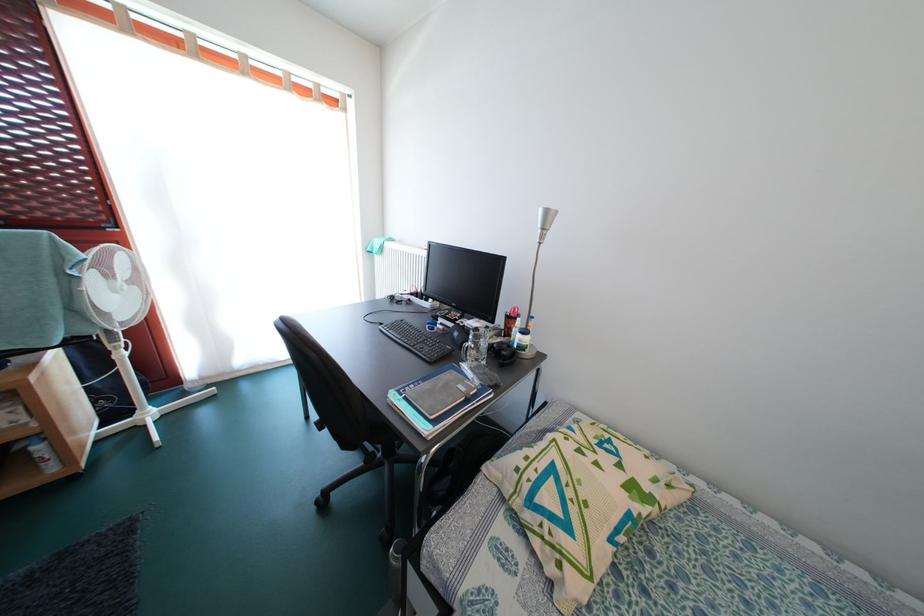
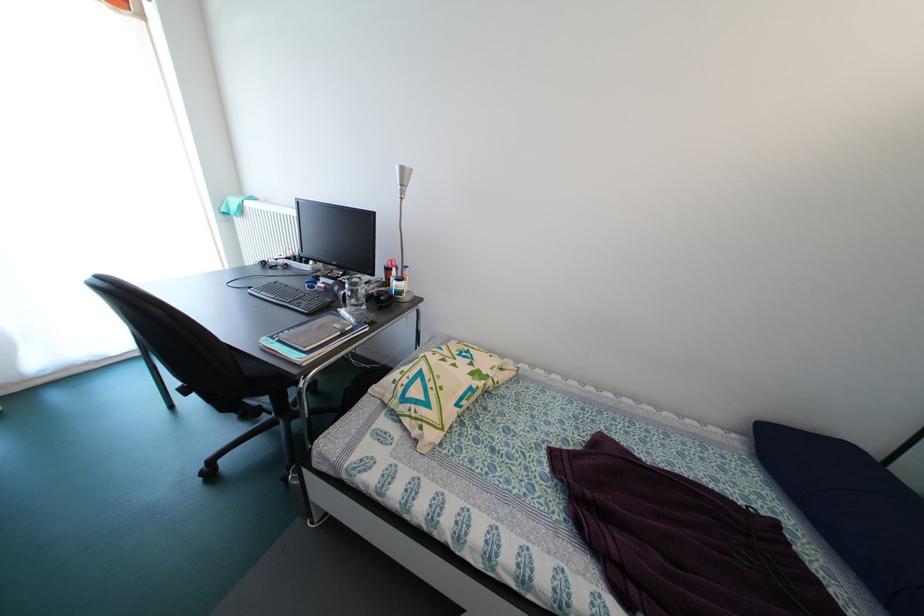
In the second image, find the point that corresponds to [463,339] in the first image.

(344, 294)